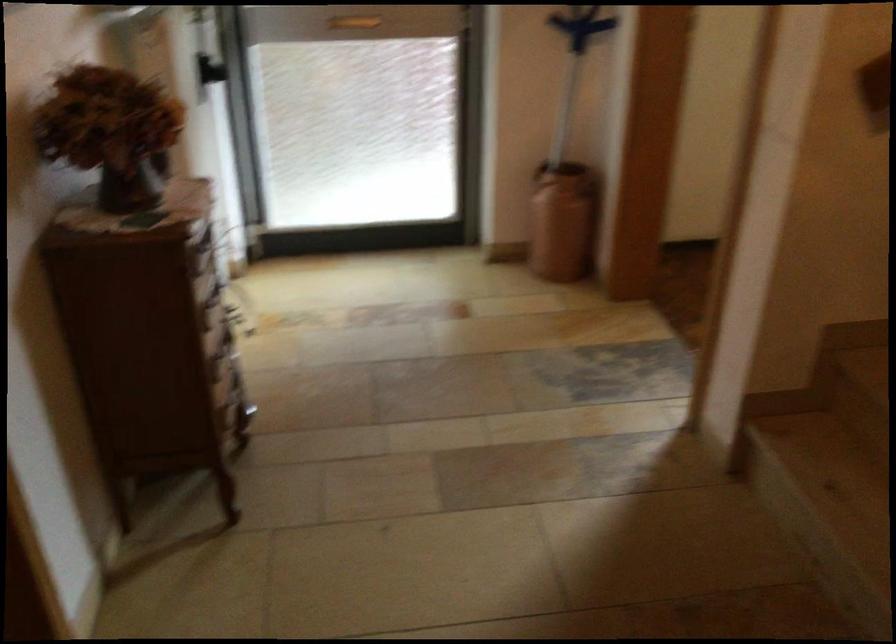
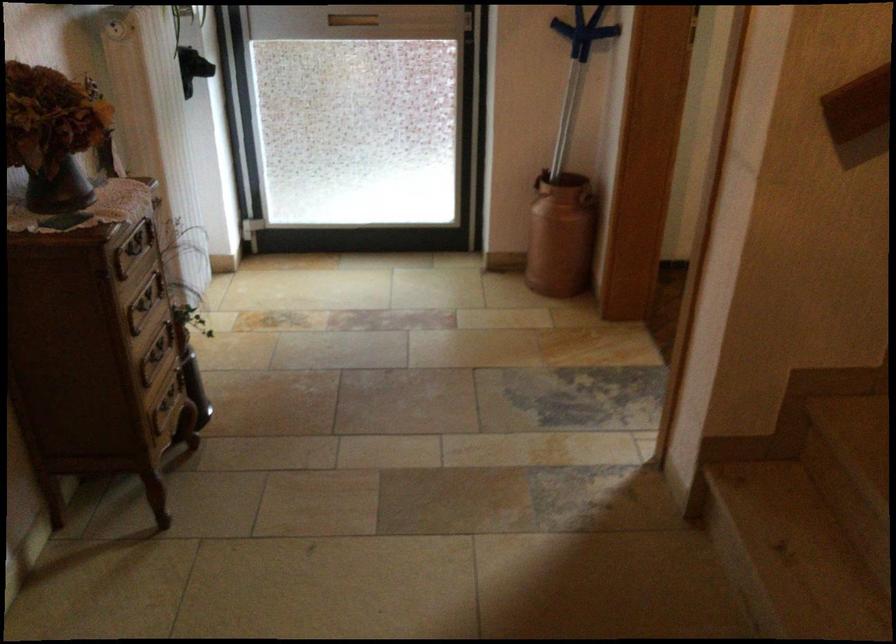
Locate, in the second image, the point that corresponds to pixel 234 399 in the first image.

(167, 404)